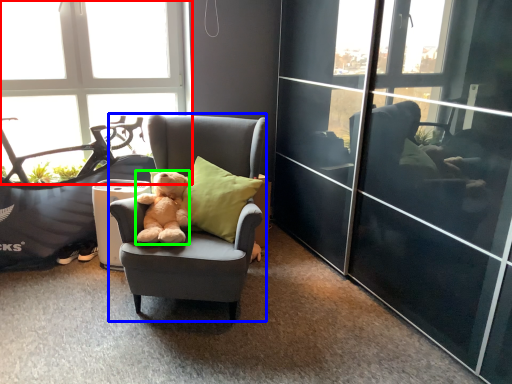
Question: Based on their relative distances, which object is farther from window (highlighted by a red box)? Choose from chair (highlighted by a blue box) and teddy bear (highlighted by a green box).

Choices:
 (A) chair
 (B) teddy bear

Answer: (A)